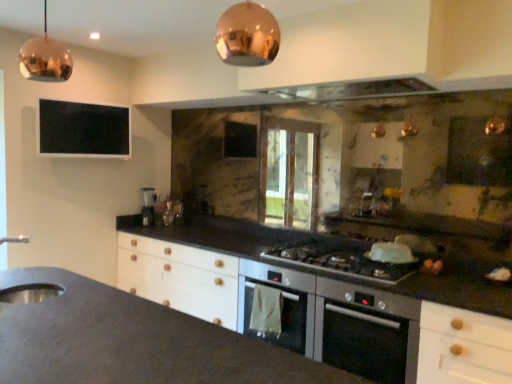
The image size is (512, 384). What do you see at coordinates (148, 206) in the screenshot?
I see `satin silver blender at center` at bounding box center [148, 206].

Describe the element at coordinates (351, 89) in the screenshot. Image resolution: width=512 pixels, height=384 pixels. I see `metallic glass at upper center` at that location.

Where is `black matte window screen at upper left`? This screenshot has height=384, width=512. black matte window screen at upper left is located at coordinates (83, 130).

This screenshot has width=512, height=384. Describe the element at coordinates (83, 130) in the screenshot. I see `black matte window screen at upper left` at that location.

The width and height of the screenshot is (512, 384). I want to click on satin silver blender at center, so click(148, 206).

From the picture: From a real-world perspective, which object rests below the other?

black matte window screen at upper left is physically lower.

How many degrees apart are the facing directions of black matte window screen at upper left and copper reflective pendant light at upper center, which is the 1th light fixture from right to left?

The facing directions of black matte window screen at upper left and copper reflective pendant light at upper center, which is the 1th light fixture from right to left, are 80.2 degrees apart.

Is point (120, 141) positioned before point (269, 12)?

No, (120, 141) is further to viewer.

In the image, is black matte window screen at upper left positioned in front of or behind copper reflective pendant light at upper center, the 1th light fixture positioned from the front?

black matte window screen at upper left is behind copper reflective pendant light at upper center, the 1th light fixture positioned from the front.

How many degrees apart are the facing directions of copper reflective pendant light at upper left, the second light fixture when ordered from right to left, and copper reflective pendant light at upper center, which appears as the second light fixture when viewed from the left?

3.45 degrees.

From the image's perspective, which is below, copper reflective pendant light at upper left, acting as the 2th light fixture starting from the front, or copper reflective pendant light at upper center, which is the 2th light fixture in back-to-front order?

copper reflective pendant light at upper center, which is the 2th light fixture in back-to-front order.

In the scene shown: Is copper reflective pendant light at upper left, the second light fixture when ordered from right to left, with copper reflective pendant light at upper center, the 1th light fixture positioned from the front?

copper reflective pendant light at upper left, the second light fixture when ordered from right to left, and copper reflective pendant light at upper center, the 1th light fixture positioned from the front, are not in contact.

Is copper reflective pendant light at upper left, the second light fixture when ordered from right to left, facing towards copper reflective pendant light at upper center, which is the 1th light fixture from right to left?

No, copper reflective pendant light at upper left, the second light fixture when ordered from right to left, is not turned towards copper reflective pendant light at upper center, which is the 1th light fixture from right to left.

Considering the positions of objects copper reflective pendant light at upper left, the 1th light fixture from the back, and stainless steel sink at lower left in the image provided, who is more to the left, copper reflective pendant light at upper left, the 1th light fixture from the back, or stainless steel sink at lower left?

Positioned to the left is stainless steel sink at lower left.

From a real-world perspective, is copper reflective pendant light at upper left, marked as the 1th light fixture in a left-to-right arrangement, physically above stainless steel sink at lower left?

Correct, in the physical world, copper reflective pendant light at upper left, marked as the 1th light fixture in a left-to-right arrangement, is higher than stainless steel sink at lower left.

Can you tell me how much copper reflective pendant light at upper left, the second light fixture when ordered from right to left, and stainless steel sink at lower left differ in facing direction?

141 degrees separate the facing orientations of copper reflective pendant light at upper left, the second light fixture when ordered from right to left, and stainless steel sink at lower left.

Considering the relative sizes of copper reflective pendant light at upper left, marked as the 1th light fixture in a left-to-right arrangement, and stainless steel sink at lower left in the image provided, is copper reflective pendant light at upper left, marked as the 1th light fixture in a left-to-right arrangement, smaller than stainless steel sink at lower left?

Correct, copper reflective pendant light at upper left, marked as the 1th light fixture in a left-to-right arrangement, occupies less space than stainless steel sink at lower left.

Is satin silver blender at center in front of or behind stainless steel oven at center in the image?

Visually, satin silver blender at center is located behind stainless steel oven at center.

Considering the sizes of satin silver blender at center and stainless steel oven at center in the image, is satin silver blender at center taller or shorter than stainless steel oven at center?

In the image, satin silver blender at center appears to be shorter than stainless steel oven at center.

Consider the image. Considering the sizes of objects satin silver blender at center and stainless steel oven at center in the image provided, who is wider, satin silver blender at center or stainless steel oven at center?

stainless steel oven at center is wider.

From a real-world perspective, which is physically below, satin silver blender at center or stainless steel oven at center?

stainless steel oven at center, from a real-world perspective.

Considering the sizes of objects satin silver gas stove at center and satin silver blender at center in the image provided, who is thinner, satin silver gas stove at center or satin silver blender at center?

satin silver blender at center.

Is point (360, 265) more distant than point (143, 219)?

That is False.

Are satin silver gas stove at center and satin silver blender at center far apart?

Yes.

Is satin silver gas stove at center bigger than satin silver blender at center?

Correct, satin silver gas stove at center is larger in size than satin silver blender at center.

Are metallic glass at upper center and stainless steel sink at lower left beside each other?

No, metallic glass at upper center is not with stainless steel sink at lower left.

From a real-world perspective, is metallic glass at upper center physically located above or below stainless steel sink at lower left?

metallic glass at upper center is situated higher than stainless steel sink at lower left in the real world.

Is metallic glass at upper center turned away from stainless steel sink at lower left?

No.

From the picture: Is metallic glass at upper center positioned beyond the bounds of stainless steel sink at lower left?

Yes, metallic glass at upper center is located beyond the bounds of stainless steel sink at lower left.

Is copper reflective pendant light at upper left, acting as the 2th light fixture starting from the front, next to satin silver blender at center?

copper reflective pendant light at upper left, acting as the 2th light fixture starting from the front, and satin silver blender at center are not in contact.

Based on the photo, is copper reflective pendant light at upper left, the 1th light fixture from the back, aimed at satin silver blender at center?

No, copper reflective pendant light at upper left, the 1th light fixture from the back, does not turn towards satin silver blender at center.

Could you measure the distance between copper reflective pendant light at upper left, the second light fixture when ordered from right to left, and satin silver blender at center?

2.29 meters.

Which is behind, point (33, 42) or point (151, 219)?

Positioned behind is point (151, 219).

This screenshot has height=384, width=512. I want to click on the 1st light fixture located above the black matte window screen at upper left (from a real-world perspective), so click(x=247, y=35).

You are a GUI agent. You are given a task and a screenshot of the screen. Output one action in this format:
    pyautogui.click(x=<x>, y=<y>)
    Task: Click on the light fixture below the copper reflective pendant light at upper left, the 1th light fixture from the back (from a real-world perspective)
    The height and width of the screenshot is (384, 512).
    Given the screenshot: What is the action you would take?
    pyautogui.click(x=247, y=35)

Estimate the real-world distances between objects in this image. Which object is closer to black matte window screen at upper left, satin silver gas stove at center or stainless steel oven at center?

Based on the image, satin silver gas stove at center appears to be nearer to black matte window screen at upper left.

From the image, which object appears to be farther from copper reflective pendant light at upper left, the 1th light fixture from the back, black matte window screen at upper left or copper reflective pendant light at upper center, which is the 2th light fixture in back-to-front order?

black matte window screen at upper left lies further to copper reflective pendant light at upper left, the 1th light fixture from the back, than the other object.

Based on their spatial positions, is satin silver blender at center or black matte window screen at upper left further from copper reflective pendant light at upper left, marked as the 1th light fixture in a left-to-right arrangement?

satin silver blender at center is further to copper reflective pendant light at upper left, marked as the 1th light fixture in a left-to-right arrangement.

When comparing their distances from copper reflective pendant light at upper center, which appears as the second light fixture when viewed from the left, does satin silver blender at center or satin silver gas stove at center seem further?

satin silver blender at center is further to copper reflective pendant light at upper center, which appears as the second light fixture when viewed from the left.

Based on their spatial positions, is stainless steel oven at center or black matte window screen at upper left further from satin silver gas stove at center?

The object further to satin silver gas stove at center is black matte window screen at upper left.

Considering their positions, is stainless steel oven at center positioned closer to copper reflective pendant light at upper left, marked as the 1th light fixture in a left-to-right arrangement, than satin silver blender at center?

stainless steel oven at center lies closer to copper reflective pendant light at upper left, marked as the 1th light fixture in a left-to-right arrangement, than the other object.

From the image, which object appears to be nearer to copper reflective pendant light at upper center, the 1th light fixture positioned from the front, satin silver gas stove at center or black matte window screen at upper left?

Based on the image, satin silver gas stove at center appears to be nearer to copper reflective pendant light at upper center, the 1th light fixture positioned from the front.

Considering their positions, is metallic glass at upper center positioned further to satin silver gas stove at center than stainless steel oven at center?

Based on the image, metallic glass at upper center appears to be further to satin silver gas stove at center.

At what (x,y) coordinates should I click in order to perform the action: click on sink situated between black matte window screen at upper left and stainless steel oven at center from left to right. Please return your answer as a coordinate pair (x, y). The width and height of the screenshot is (512, 384). Looking at the image, I should click on (30, 293).

The width and height of the screenshot is (512, 384). Find the location of `oven between copper reflective pendant light at upper center, which is the 1th light fixture from right to left, and satin silver gas stove at center, along the z-axis`. oven between copper reflective pendant light at upper center, which is the 1th light fixture from right to left, and satin silver gas stove at center, along the z-axis is located at coordinates (338, 322).

This screenshot has height=384, width=512. I want to click on sink between black matte window screen at upper left and satin silver gas stove at center, so click(x=30, y=293).

This screenshot has width=512, height=384. In order to click on gas stove located between stainless steel sink at lower left and stainless steel oven at center in the left-right direction in this screenshot , I will do `click(340, 262)`.